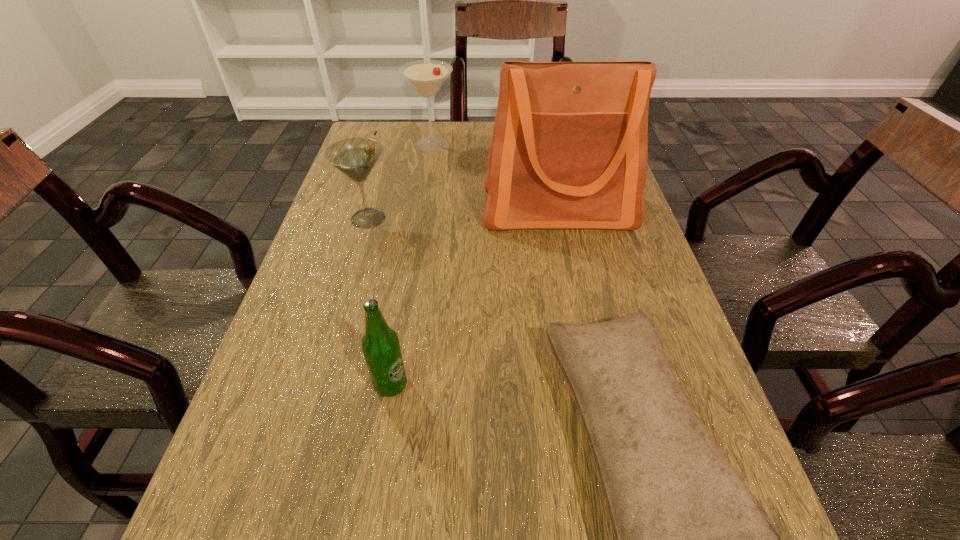
Choose which object is the fourth nearest neighbor to the beer bottle. Please provide its 2D coordinates. Your answer should be formatted as a tuple, i.e. [(x, y)], where the tuple contains the x and y coordinates of a point satisfying the conditions above.

[(426, 76)]